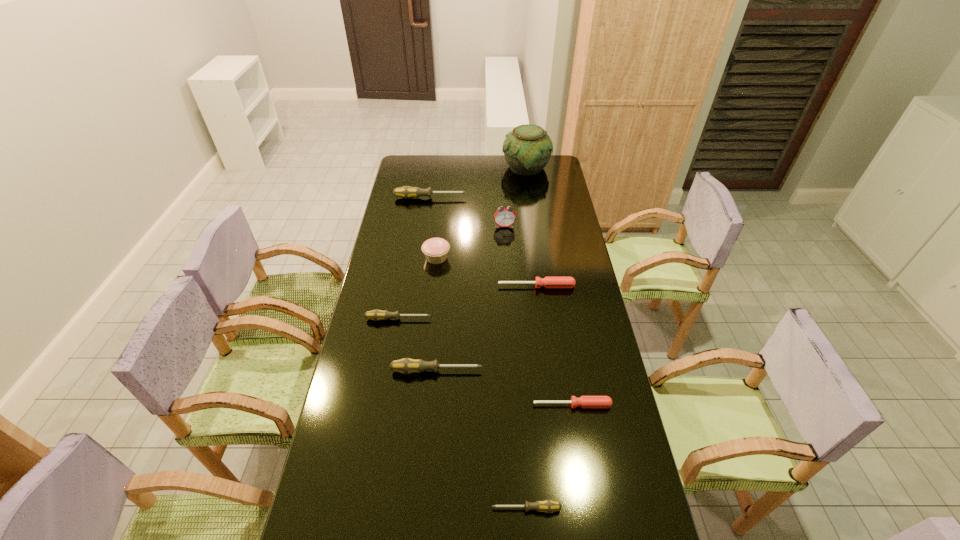
You are a GUI agent. You are given a task and a screenshot of the screen. Output one action in this format:
    pyautogui.click(x=<x>, y=<y>)
    Task: Click on the farthest object
    The width and height of the screenshot is (960, 540).
    Given the screenshot: What is the action you would take?
    pyautogui.click(x=527, y=149)

Find the location of a particular element. pottery is located at coordinates (527, 149).

Find the location of `the eighth shortest object`. the eighth shortest object is located at coordinates pyautogui.click(x=504, y=217).

Locate an element on the screen. The image size is (960, 540). alarm clock is located at coordinates (504, 217).

Identify the location of pink cupcake. [x=435, y=250].

At what (x,y) coordinates should I click in order to perform the action: click on cupcake. Please return your answer as a coordinate pair (x, y). Looking at the image, I should click on (435, 250).

Find the location of a particular element. This screenshot has width=960, height=540. the biggest gray screwdriver is located at coordinates (406, 192).

Locate an element on the screen. Image resolution: width=960 pixels, height=540 pixels. the second farthest object is located at coordinates (406, 192).

In order to click on the third nearest screwdriver in this screenshot , I will do pyautogui.click(x=406, y=365).

Locate an element on the screen. The width and height of the screenshot is (960, 540). the second biggest gray screwdriver is located at coordinates (406, 365).